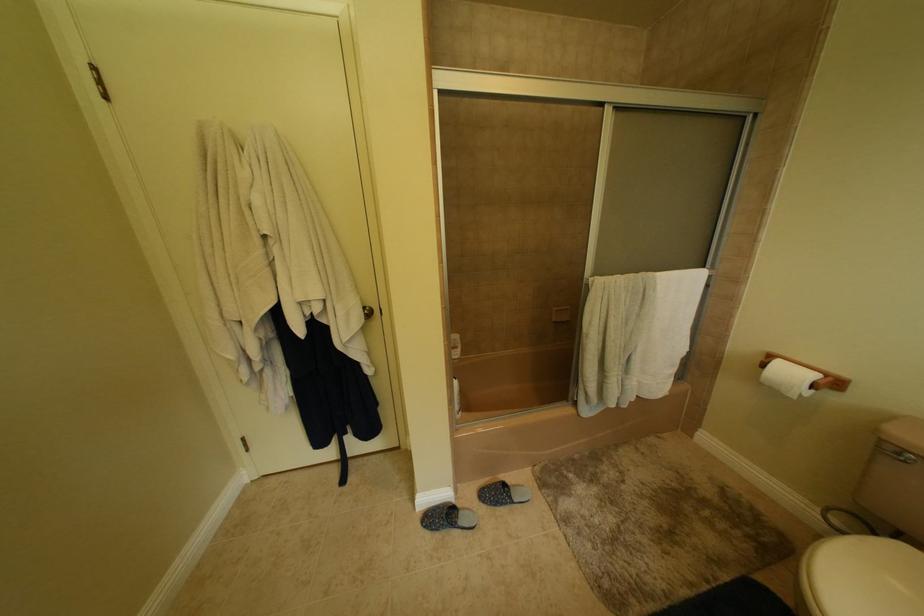
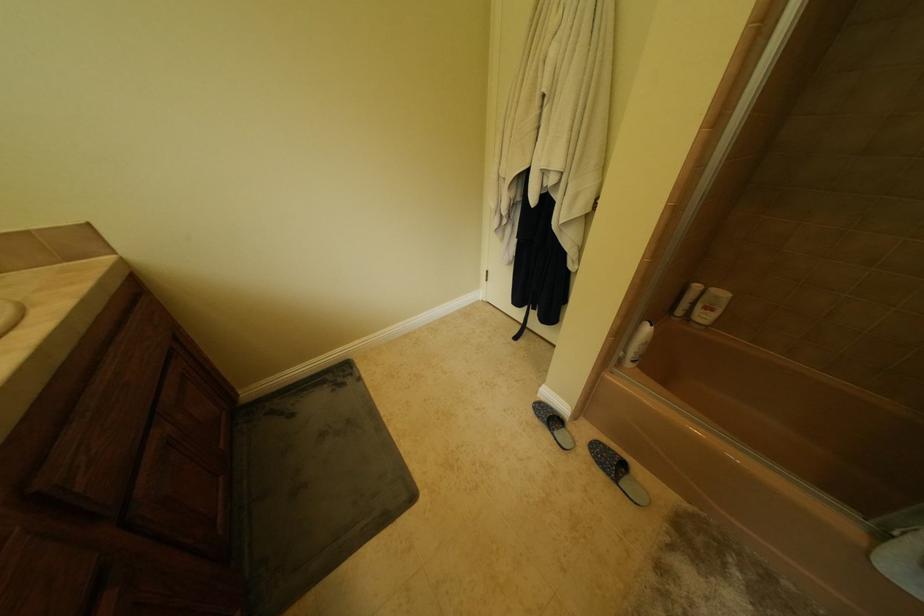
Based on the continuous images, in which direction is the camera rotating?

The camera's rotation is toward left-down.